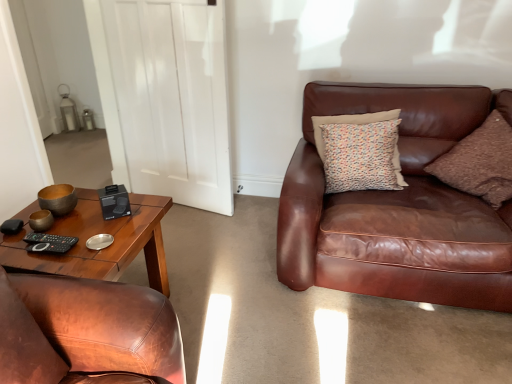
The width and height of the screenshot is (512, 384). I want to click on unoccupied space behind black matte remote at lower left, so click(x=78, y=224).